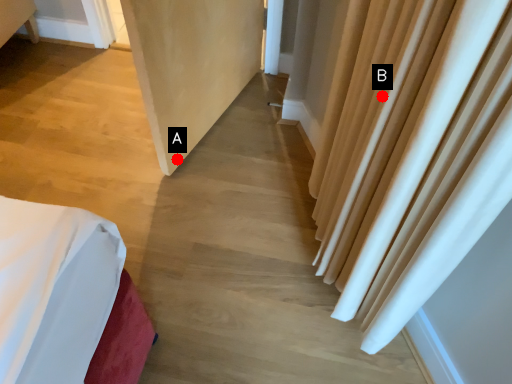
Question: Two points are circled on the image, labeled by A and B beside each circle. Which point appears closest to the camera in this image?

Choices:
 (A) A is closer
 (B) B is closer

Answer: (B)